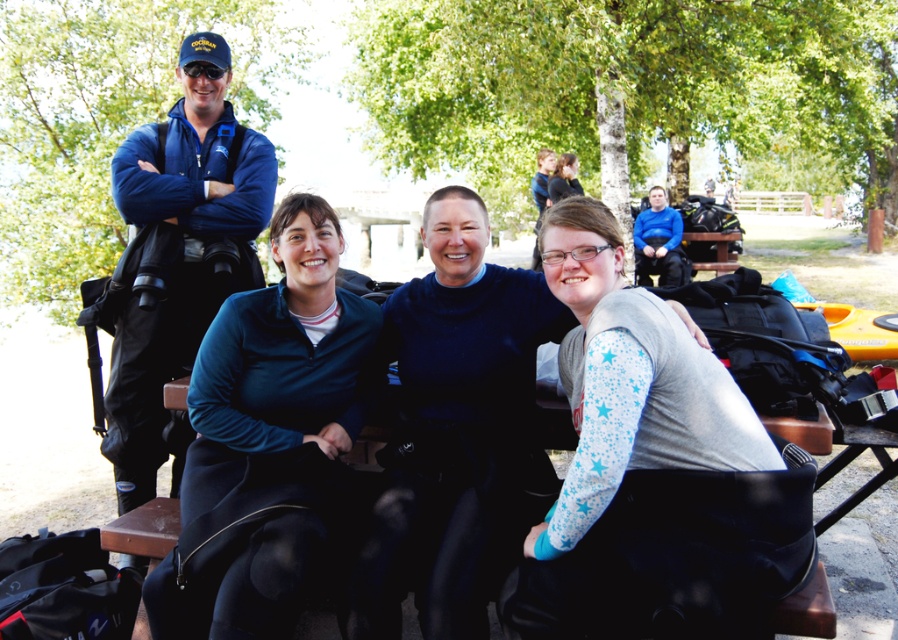
Question: In this image, where is blue fleece jacket at center located relative to matte black jacket at upper center?

Choices:
 (A) right
 (B) left

Answer: (B)

Question: Is blue fleece jacket at center below matte black jacket at upper center?

Choices:
 (A) yes
 (B) no

Answer: (A)

Question: Which point appears farthest from the camera in this image?

Choices:
 (A) (148, 627)
 (B) (549, 179)
 (C) (614, 477)

Answer: (B)

Question: Estimate the real-world distances between objects in this image. Which object is closer to the matte black jacket at upper center?

Choices:
 (A) blue fleece jacket at center
 (B) white matte shirt at center

Answer: (A)

Question: Is blue fleece jacket at center to the left of white matte shirt at center from the viewer's perspective?

Choices:
 (A) yes
 (B) no

Answer: (A)

Question: Which point is farther to the camera?

Choices:
 (A) (740, 394)
 (B) (570, 161)
 (C) (313, 529)

Answer: (B)